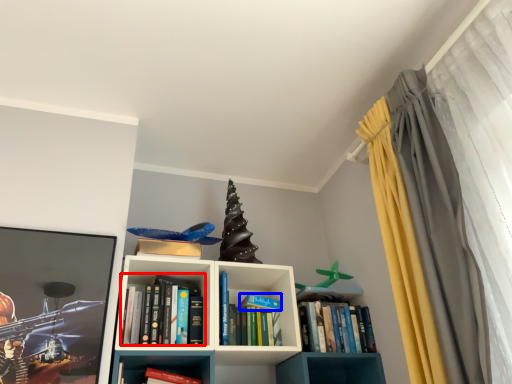
Question: Which object is closer to the camera taking this photo, book (highlighted by a red box) or paperback book (highlighted by a blue box)?

Choices:
 (A) book
 (B) paperback book

Answer: (A)